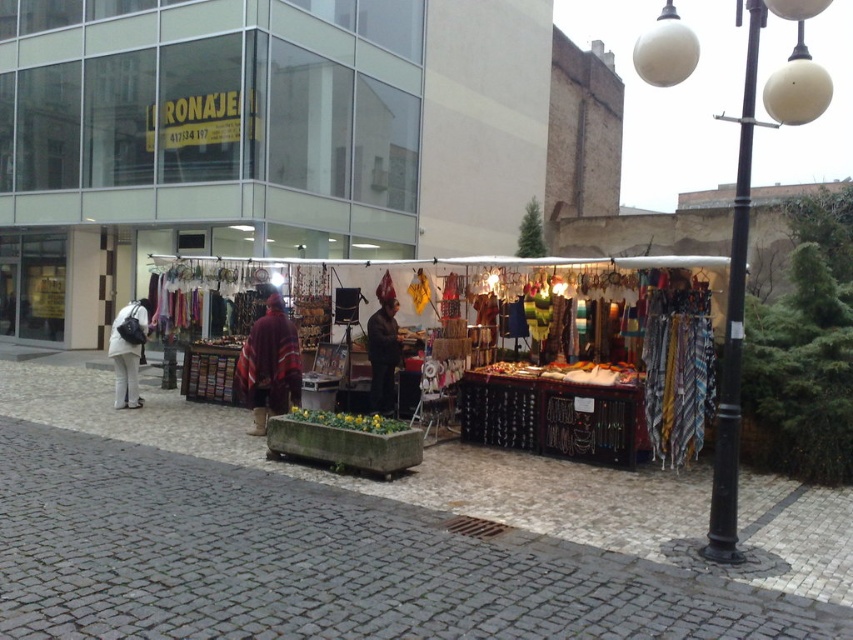
Question: Which object is the farthest from the dark brown leather jacket at center?

Choices:
 (A) textured fabric market at center
 (B) textured fabric stall at center

Answer: (B)

Question: Which object appears closest to the camera in this image?

Choices:
 (A) dark brown leather jacket at center
 (B) textured fabric market at center

Answer: (A)

Question: Can you confirm if textured fabric market at center is positioned below knitted woolen shawl at center?

Choices:
 (A) no
 (B) yes

Answer: (A)

Question: Which point is farther to the camera?

Choices:
 (A) textured fabric stall at center
 (B) knitted woolen shawl at center
 (C) textured fabric market at center
 (D) white matte coat at left

Answer: (D)

Question: Is textured fabric stall at center below knitted woolen shawl at center?

Choices:
 (A) no
 (B) yes

Answer: (A)

Question: Is textured fabric stall at center behind white matte coat at left?

Choices:
 (A) yes
 (B) no

Answer: (B)